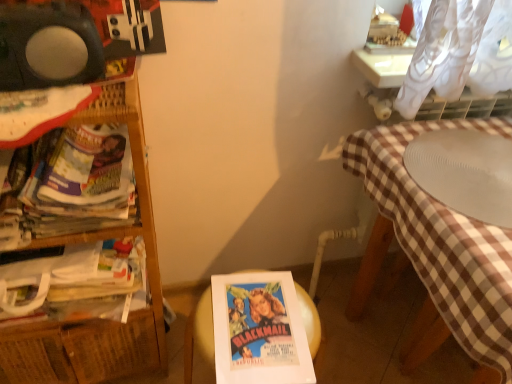
Question: Is white paper at center inside the boundaries of white ribbed plate at right, or outside?

Choices:
 (A) outside
 (B) inside

Answer: (A)

Question: From a real-world perspective, is white paper at center physically located above or below white ribbed plate at right?

Choices:
 (A) above
 (B) below

Answer: (B)

Question: Estimate the real-world distances between objects in this image. Which object is farther from the white ribbed plate at right?

Choices:
 (A) white paper book at left, the 1th book viewed from the top
 (B) white paper at center
 (C) woven wood shelf at left
 (D) paperback book at left, which is the second book from top to bottom

Answer: (D)

Question: Which object is the farthest from the woven wood shelf at left?

Choices:
 (A) white ribbed plate at right
 (B) white paper at center
 (C) paperback book at left, which appears as the first book when ordered from the bottom
 (D) white paper book at left, the 1th book viewed from the top

Answer: (A)